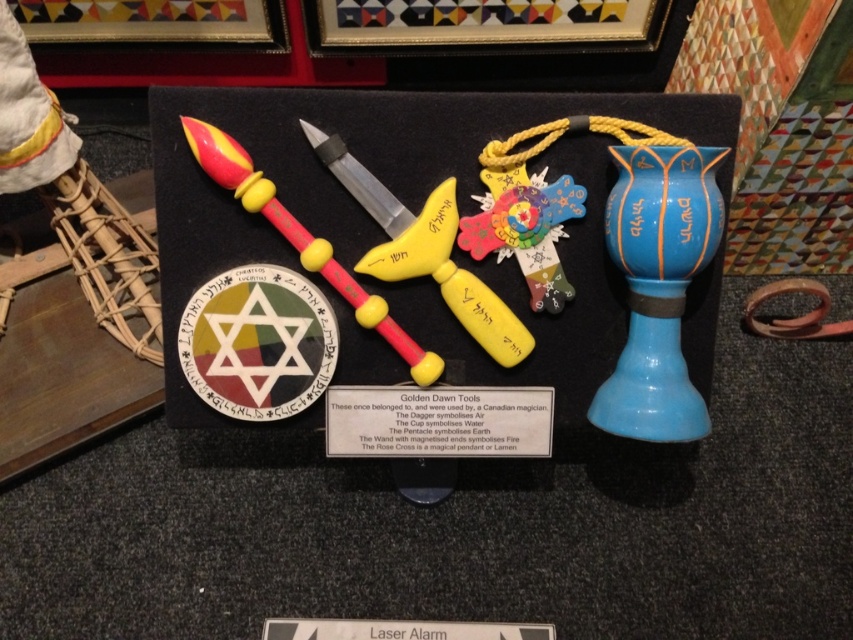
You are an apprentice magician preparing for a ritual. You need to place a candle on the highest object in the display. Which object should you choose between the wooden circular object at center and the matte plastic wand at center?

The matte plastic wand at center has a greater height than the wooden circular object at center, so you should place the candle on the matte plastic wand at center.

You are standing in front of a mystical display case containing a yellow matte knife at center. If you want to reach into the case to touch the knife, will your hand be able to comfortably fit inside the space between you and the knife?

The distance between you and the yellow matte knife at center is 38.39 inches, which is more than enough space for your hand to comfortably reach and touch the knife.

You are an apprentice magician preparing to place both the yellow matte knife at center and the matte plastic wand at center into a rectangular box. The box has a width that can only accommodate the narrower object. Which object should you choose to fit into the box first?

The yellow matte knife at center has a lesser width compared to the matte plastic wand at center, so you should place the yellow matte knife at center first to ensure it fits into the box.